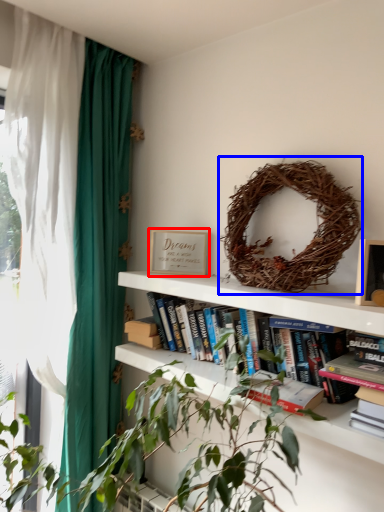
Question: Among these objects, which one is farthest to the camera, paperback book (highlighted by a red box) or bird nest (highlighted by a blue box)?

Choices:
 (A) paperback book
 (B) bird nest

Answer: (A)